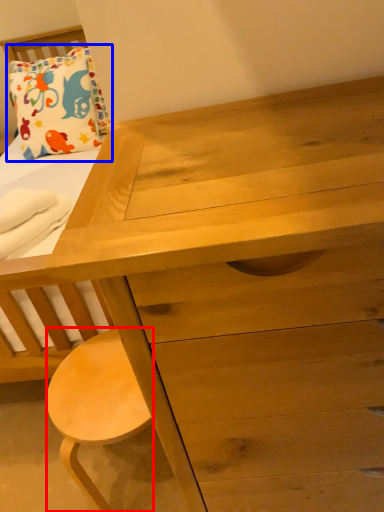
Question: Which object is closer to the camera taking this photo, stool (highlighted by a red box) or pillow (highlighted by a blue box)?

Choices:
 (A) stool
 (B) pillow

Answer: (A)